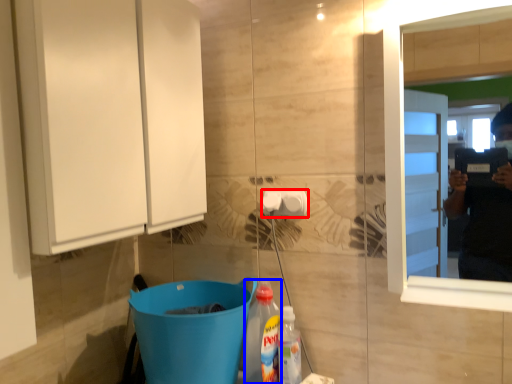
Question: Which object appears farthest to the camera in this image, towel bar (highlighted by a red box) or bottle (highlighted by a blue box)?

Choices:
 (A) towel bar
 (B) bottle

Answer: (A)